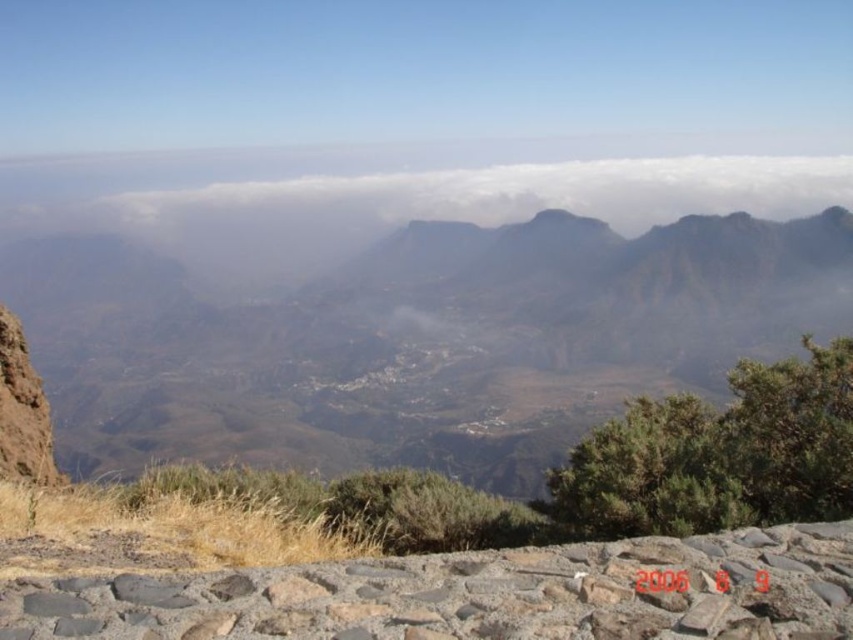
You are a drone operator tasked with capturing aerial footage of the rugged rock mountain at center and the white fluffy cloud at center. Your drone has a maximum flight range of 150 meters. Can your drone safely fly between these two points without exceeding its range?

The distance between the rugged rock mountain at center and the white fluffy cloud at center is 145.37 meters, which is within the drone operator s 150 meter range. Therefore, the drone can safely fly between these two points without exceeding its maximum flight range.

You are standing at the highest point of the mountain and looking down at the rocky terrain. There is a gray rough stone located at point (x=477, y=595). Can you confirm if this point is in the lower center area of the image?

Yes, the point (x=477, y=595) corresponds to the gray rough stone at lower center, so it is indeed located in the lower center area of the image.